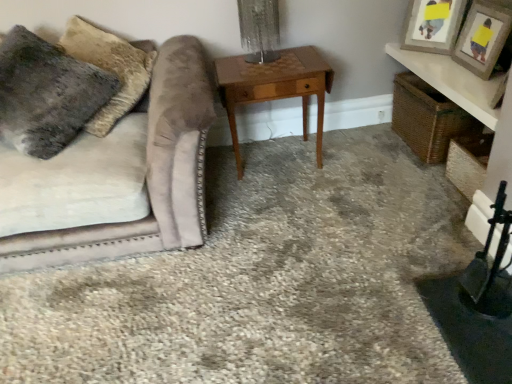
The width and height of the screenshot is (512, 384). What do you see at coordinates (432, 25) in the screenshot?
I see `wooden picture frame at upper right, which ranks as the 2th picture frame in front-to-back order` at bounding box center [432, 25].

Locate an element on the screen. This screenshot has width=512, height=384. fuzzy gray pillow at upper left is located at coordinates (46, 94).

Image resolution: width=512 pixels, height=384 pixels. Find the location of `velvet beige couch at left`. velvet beige couch at left is located at coordinates [116, 178].

Can you tell me how much wooden picture frame at upper right, marked as the first picture frame in a back-to-front arrangement, and velvet beige couch at left differ in facing direction?

47.8 degrees separate the facing orientations of wooden picture frame at upper right, marked as the first picture frame in a back-to-front arrangement, and velvet beige couch at left.

From the picture: Would you say wooden picture frame at upper right, which ranks as the 2th picture frame in front-to-back order, is to the left or to the right of velvet beige couch at left in the picture?

From the image, it's evident that wooden picture frame at upper right, which ranks as the 2th picture frame in front-to-back order, is to the right of velvet beige couch at left.

In the scene shown: From a real-world perspective, is wooden picture frame at upper right, marked as the first picture frame in a back-to-front arrangement, on top of velvet beige couch at left?

Yes, from a real-world perspective, wooden picture frame at upper right, marked as the first picture frame in a back-to-front arrangement, is above velvet beige couch at left.

From the image's perspective, is wooden picture frame at upper right, which ranks as the 2th picture frame in front-to-back order, located above velvet beige couch at left?

Yes, from the image's perspective, wooden picture frame at upper right, which ranks as the 2th picture frame in front-to-back order, is on top of velvet beige couch at left.

Which point is more forward, (276,61) or (68,50)?

Positioned in front is point (68,50).

Find the location of a particular element. studio couch to the left of light brown wood table at center is located at coordinates (116, 178).

Is light brown wood table at center facing towards velvet beige couch at left?

No, light brown wood table at center does not turn towards velvet beige couch at left.

From the image's perspective, between light brown wood table at center and velvet beige couch at left, which one is located above?

From the image's view, light brown wood table at center is above.

Is light brown wood table at center to the left of fuzzy gray pillow at upper left from the viewer's perspective?

No.

Who is bigger, light brown wood table at center or fuzzy gray pillow at upper left?

Bigger between the two is fuzzy gray pillow at upper left.

From a real-world perspective, who is located lower, light brown wood table at center or fuzzy gray pillow at upper left?

In real-world perspective, light brown wood table at center is lower.

Are light brown wood table at center and fuzzy gray pillow at upper left making contact?

No.

Which object is further away from the camera, velvet beige couch at left or wooden picture frame at upper right, which is the 1th picture frame in front-to-back order?

wooden picture frame at upper right, which is the 1th picture frame in front-to-back order, is further away from the camera.

Does velvet beige couch at left turn towards wooden picture frame at upper right, which is the 1th picture frame in front-to-back order?

No, velvet beige couch at left does not turn towards wooden picture frame at upper right, which is the 1th picture frame in front-to-back order.

Looking at this image, from the image's perspective, between velvet beige couch at left and wooden picture frame at upper right, placed as the second picture frame when sorted from back to front, who is located below?

velvet beige couch at left, from the image's perspective.

Is velvet beige couch at left thinner than wooden picture frame at upper right, placed as the second picture frame when sorted from back to front?

Incorrect, the width of velvet beige couch at left is not less than that of wooden picture frame at upper right, placed as the second picture frame when sorted from back to front.

From the picture: Considering the relative positions of velvet beige couch at left and light brown wood table at center in the image provided, is velvet beige couch at left to the right of light brown wood table at center from the viewer's perspective?

Incorrect, velvet beige couch at left is not on the right side of light brown wood table at center.

Is velvet beige couch at left not near light brown wood table at center?

They are positioned close to each other.

Looking at this image, between velvet beige couch at left and light brown wood table at center, which one has larger width?

velvet beige couch at left is wider.

Is wooden picture frame at upper right, which ranks as the 2th picture frame in front-to-back order, positioned before light brown wood table at center?

That is False.

Find the location of a particular element. table below the wooden picture frame at upper right, which ranks as the 2th picture frame in front-to-back order (from the image's perspective) is located at coordinates (275, 87).

Between wooden picture frame at upper right, marked as the first picture frame in a back-to-front arrangement, and light brown wood table at center, which one appears on the right side from the viewer's perspective?

From the viewer's perspective, wooden picture frame at upper right, marked as the first picture frame in a back-to-front arrangement, appears more on the right side.

From the image's perspective, is fuzzy gray pillow at upper left on wooden picture frame at upper right, placed as the second picture frame when sorted from back to front?

No.

Considering the relative sizes of fuzzy gray pillow at upper left and wooden picture frame at upper right, placed as the second picture frame when sorted from back to front, in the image provided, is fuzzy gray pillow at upper left smaller than wooden picture frame at upper right, placed as the second picture frame when sorted from back to front,?

Incorrect, fuzzy gray pillow at upper left is not smaller in size than wooden picture frame at upper right, placed as the second picture frame when sorted from back to front.

Considering the relative sizes of fuzzy gray pillow at upper left and wooden picture frame at upper right, which is the 1th picture frame in front-to-back order, in the image provided, is fuzzy gray pillow at upper left shorter than wooden picture frame at upper right, which is the 1th picture frame in front-to-back order,?

No.

Which is closer to the camera, (20, 139) or (495, 12)?

Point (20, 139) is closer to the camera than point (495, 12).

From the image's perspective, which picture frame is the 2nd one above the velvet beige couch at left? Please provide its 2D coordinates.

[(432, 25)]

Where is `studio couch below the light brown wood table at center (from the image's perspective)`? This screenshot has height=384, width=512. studio couch below the light brown wood table at center (from the image's perspective) is located at coordinates (116, 178).

Looking at the image, which one is located closer to velvet beige couch at left, fuzzy gray pillow at upper left or wooden picture frame at upper right, which ranks as the 2th picture frame in front-to-back order?

fuzzy gray pillow at upper left is closer to velvet beige couch at left.

Considering their positions, is wooden picture frame at upper right, which ranks as the 2th picture frame in front-to-back order, positioned closer to wooden picture frame at upper right, placed as the second picture frame when sorted from back to front, than fuzzy gray pillow at upper left?

The object closer to wooden picture frame at upper right, placed as the second picture frame when sorted from back to front, is wooden picture frame at upper right, which ranks as the 2th picture frame in front-to-back order.

Considering their positions, is velvet beige couch at left positioned further to light brown wood table at center than wooden picture frame at upper right, which is the 1th picture frame in front-to-back order?

Among the two, wooden picture frame at upper right, which is the 1th picture frame in front-to-back order, is located further to light brown wood table at center.

Which object lies further to the anchor point fuzzy gray pillow at upper left, wooden picture frame at upper right, marked as the first picture frame in a back-to-front arrangement, or wooden picture frame at upper right, placed as the second picture frame when sorted from back to front?

Among the two, wooden picture frame at upper right, placed as the second picture frame when sorted from back to front, is located further to fuzzy gray pillow at upper left.

Considering their positions, is wooden picture frame at upper right, which is the 1th picture frame in front-to-back order, positioned further to light brown wood table at center than wooden picture frame at upper right, which ranks as the 2th picture frame in front-to-back order?

wooden picture frame at upper right, which is the 1th picture frame in front-to-back order, is positioned further to the anchor light brown wood table at center.

Which object lies nearer to the anchor point wooden picture frame at upper right, marked as the first picture frame in a back-to-front arrangement, velvet beige couch at left or fuzzy gray pillow at upper left?

velvet beige couch at left is closer to wooden picture frame at upper right, marked as the first picture frame in a back-to-front arrangement.

Looking at the image, which one is located closer to wooden picture frame at upper right, placed as the second picture frame when sorted from back to front, wooden picture frame at upper right, which ranks as the 2th picture frame in front-to-back order, or light brown wood table at center?

wooden picture frame at upper right, which ranks as the 2th picture frame in front-to-back order.

From the image, which object appears to be farther from light brown wood table at center, wooden picture frame at upper right, marked as the first picture frame in a back-to-front arrangement, or wooden picture frame at upper right, placed as the second picture frame when sorted from back to front?

wooden picture frame at upper right, placed as the second picture frame when sorted from back to front, is further to light brown wood table at center.

The image size is (512, 384). I want to click on table between fuzzy gray pillow at upper left and wooden picture frame at upper right, marked as the first picture frame in a back-to-front arrangement, in the horizontal direction, so click(x=275, y=87).

The width and height of the screenshot is (512, 384). Identify the location of picture frame between fuzzy gray pillow at upper left and wooden picture frame at upper right, placed as the second picture frame when sorted from back to front, from left to right. (432, 25).

Locate an element on the screen. The width and height of the screenshot is (512, 384). table between velvet beige couch at left and wooden picture frame at upper right, which is the 1th picture frame in front-to-back order is located at coordinates (275, 87).

Image resolution: width=512 pixels, height=384 pixels. Find the location of `picture frame between velvet beige couch at left and wooden picture frame at upper right, placed as the second picture frame when sorted from back to front`. picture frame between velvet beige couch at left and wooden picture frame at upper right, placed as the second picture frame when sorted from back to front is located at coordinates (432, 25).